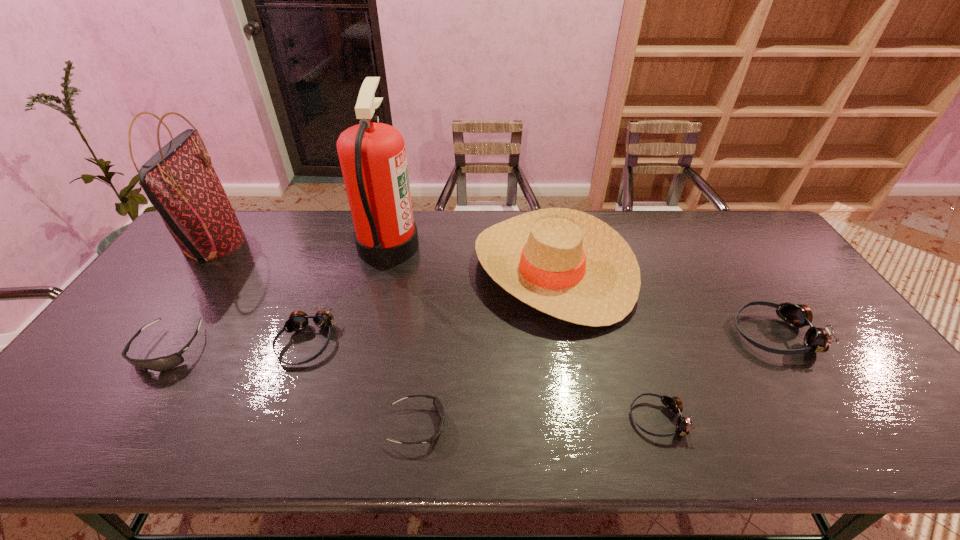
I want to click on free space located 0.130m on the lenses of the bigger black goggles, so click(x=119, y=423).

I want to click on vacant space located 0.290m through the lenses of the second bronze goggles from right to left, so click(x=503, y=418).

Locate an element on the screen. This screenshot has width=960, height=540. free space located 0.290m through the lenses of the second bronze goggles from right to left is located at coordinates (503, 418).

At what (x,y) coordinates should I click in order to perform the action: click on free region located through the lenses of the second bronze goggles from right to left. Please return your answer as a coordinate pair (x, y). Image resolution: width=960 pixels, height=540 pixels. Looking at the image, I should click on (459, 418).

The width and height of the screenshot is (960, 540). I want to click on vacant area situated 0.370m on the lenses of the fourth object from right to left, so click(x=610, y=425).

This screenshot has width=960, height=540. I want to click on fire extinguisher that is at the far edge, so click(x=372, y=155).

You are a GUI agent. You are given a task and a screenshot of the screen. Output one action in this format:
    pyautogui.click(x=<x>, y=<y>)
    Task: Click on the handbag positioned at the far edge
    
    Given the screenshot: What is the action you would take?
    pyautogui.click(x=179, y=180)

Where is `sunhat that is positioned at the far edge`? sunhat that is positioned at the far edge is located at coordinates (566, 263).

Locate an element on the screen. handbag that is at the left edge is located at coordinates (179, 180).

Locate an element on the screen. The image size is (960, 540). goggles present at the left edge is located at coordinates (163, 363).